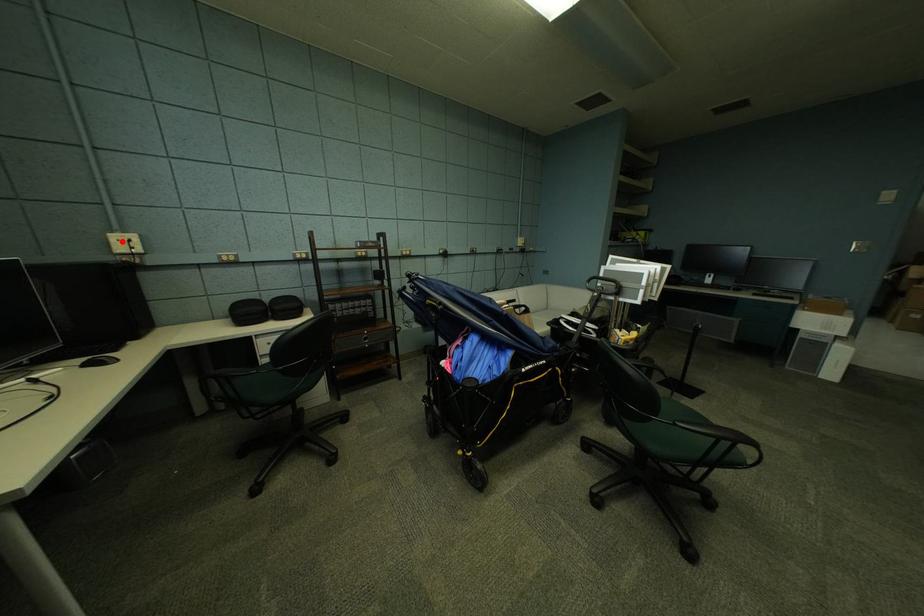
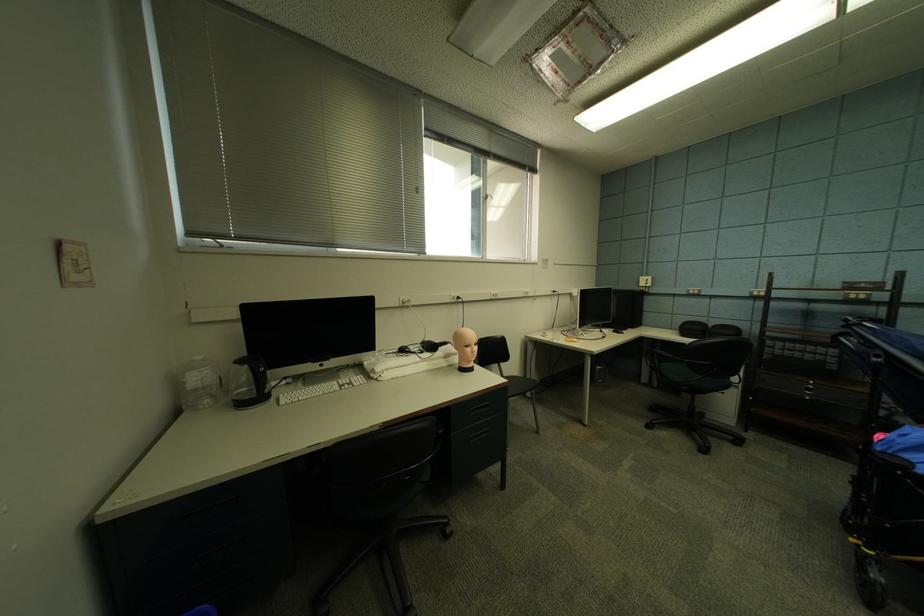
Question: I am providing you with two images of the same scene from different viewpoints. A red point is marked on the first image. Can you still see the location of the red point in image 2?

Choices:
 (A) Yes
 (B) No

Answer: (A)